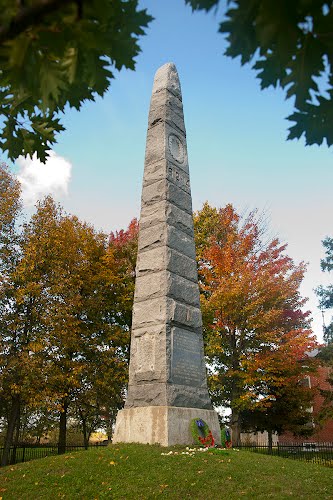
This screenshot has width=333, height=500. What are the coordinates of `plaque` in the screenshot? It's located at (183, 364).